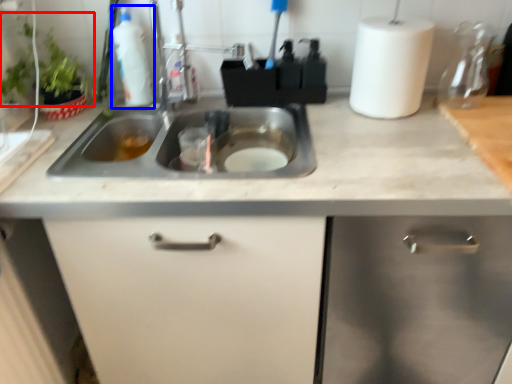
Question: Which of the following is the farthest to the observer, plant (highlighted by a red box) or cleaning product (highlighted by a blue box)?

Choices:
 (A) plant
 (B) cleaning product

Answer: (B)